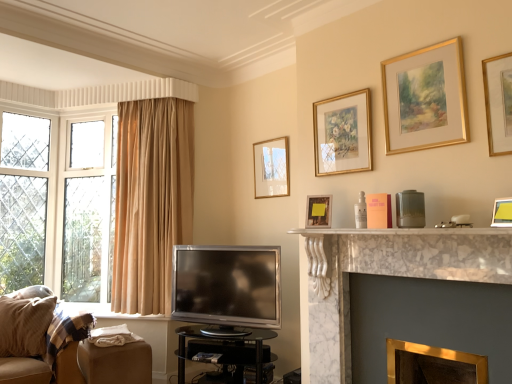
Question: Does white marble fireplace at center, the 1th fireplace in the top-to-bottom sequence, turn towards beige fabric couch at lower left?

Choices:
 (A) no
 (B) yes

Answer: (A)

Question: Is white marble fireplace at center, arranged as the second fireplace when ordered from the bottom, bigger than beige fabric couch at lower left?

Choices:
 (A) no
 (B) yes

Answer: (A)

Question: Is white marble fireplace at center, arranged as the second fireplace when ordered from the bottom, smaller than beige fabric couch at lower left?

Choices:
 (A) no
 (B) yes

Answer: (B)

Question: Is the position of white marble fireplace at center, the 1th fireplace in the top-to-bottom sequence, more distant than that of beige fabric couch at lower left?

Choices:
 (A) no
 (B) yes

Answer: (A)

Question: Is white marble fireplace at center, arranged as the second fireplace when ordered from the bottom, placed right next to beige fabric couch at lower left?

Choices:
 (A) no
 (B) yes

Answer: (A)

Question: Is white marble fireplace at center, arranged as the second fireplace when ordered from the bottom, at the left side of beige fabric couch at lower left?

Choices:
 (A) no
 (B) yes

Answer: (A)

Question: Considering the relative positions of gold metallic fireplace at lower right, which appears as the second fireplace when viewed from the top, and matte yellow picture frame at upper right, arranged as the 2th picture frame when viewed from the right, in the image provided, is gold metallic fireplace at lower right, which appears as the second fireplace when viewed from the top, in front of matte yellow picture frame at upper right, arranged as the 2th picture frame when viewed from the right,?

Choices:
 (A) yes
 (B) no

Answer: (B)

Question: From a real-world perspective, is gold metallic fireplace at lower right, which appears as the second fireplace when viewed from the top, over matte yellow picture frame at upper right, which ranks as the fifth picture frame in left-to-right order?

Choices:
 (A) yes
 (B) no

Answer: (B)

Question: Is gold metallic fireplace at lower right, which appears as the second fireplace when viewed from the top, far away from matte yellow picture frame at upper right, which is the 1th picture frame from front to back?

Choices:
 (A) yes
 (B) no

Answer: (B)

Question: Considering the relative sizes of gold metallic fireplace at lower right, positioned as the first fireplace in bottom-to-top order, and matte yellow picture frame at upper right, placed as the sixth picture frame when sorted from back to front, in the image provided, is gold metallic fireplace at lower right, positioned as the first fireplace in bottom-to-top order, wider than matte yellow picture frame at upper right, placed as the sixth picture frame when sorted from back to front,?

Choices:
 (A) no
 (B) yes

Answer: (B)

Question: Could matte yellow picture frame at upper right, which ranks as the fifth picture frame in left-to-right order, be considered to be inside gold metallic fireplace at lower right, which appears as the second fireplace when viewed from the top?

Choices:
 (A) yes
 (B) no

Answer: (B)

Question: Considering the relative sizes of gold metallic fireplace at lower right, positioned as the first fireplace in bottom-to-top order, and matte yellow picture frame at upper right, arranged as the 2th picture frame when viewed from the right, in the image provided, is gold metallic fireplace at lower right, positioned as the first fireplace in bottom-to-top order, smaller than matte yellow picture frame at upper right, arranged as the 2th picture frame when viewed from the right,?

Choices:
 (A) yes
 (B) no

Answer: (B)

Question: Considering the relative sizes of transparent glass table at center and gold-framed picture at upper right, placed as the 2th picture frame when sorted from front to back, in the image provided, is transparent glass table at center wider than gold-framed picture at upper right, placed as the 2th picture frame when sorted from front to back,?

Choices:
 (A) yes
 (B) no

Answer: (A)